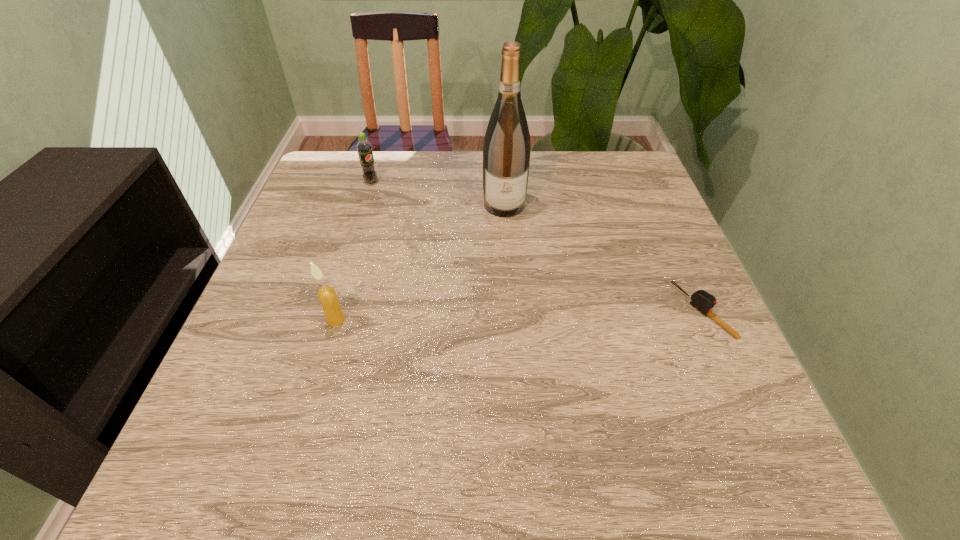
Find the location of a particular element. object at the far left corner is located at coordinates (364, 148).

Identify the location of vacant space at the far edge of the desktop. Image resolution: width=960 pixels, height=540 pixels. (453, 190).

The height and width of the screenshot is (540, 960). I want to click on vacant space at the near edge of the desktop, so click(x=400, y=375).

The height and width of the screenshot is (540, 960). In the image, there is a desktop. What are the coordinates of `vacant space at the left edge` in the screenshot? It's located at (330, 264).

Identify the location of free space at the right edge. (661, 233).

Locate an element on the screen. vacant area at the far left corner is located at coordinates (354, 173).

The image size is (960, 540). Find the location of `vacant space at the near right corner of the desktop`. vacant space at the near right corner of the desktop is located at coordinates (756, 407).

In order to click on free point between the rightmost object and the farthest object in this screenshot , I will do `click(538, 247)`.

What are the coordinates of `free space between the wine bottle and the soda` in the screenshot? It's located at (438, 193).

This screenshot has height=540, width=960. I want to click on vacant area between the tape measure and the candle, so click(x=519, y=315).